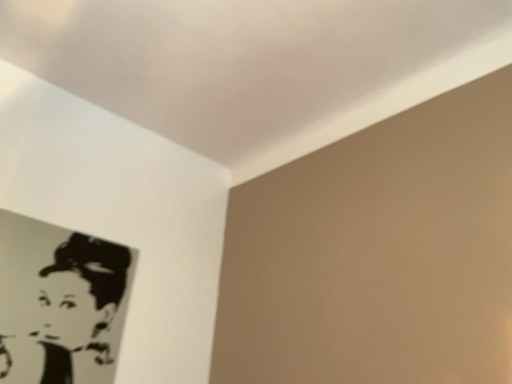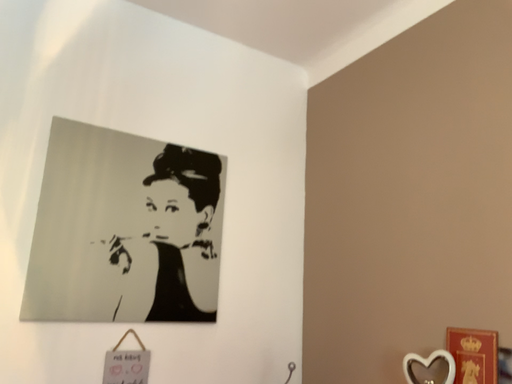
Question: Which way did the camera rotate in the video?

Choices:
 (A) rotated downward
 (B) rotated upward

Answer: (A)